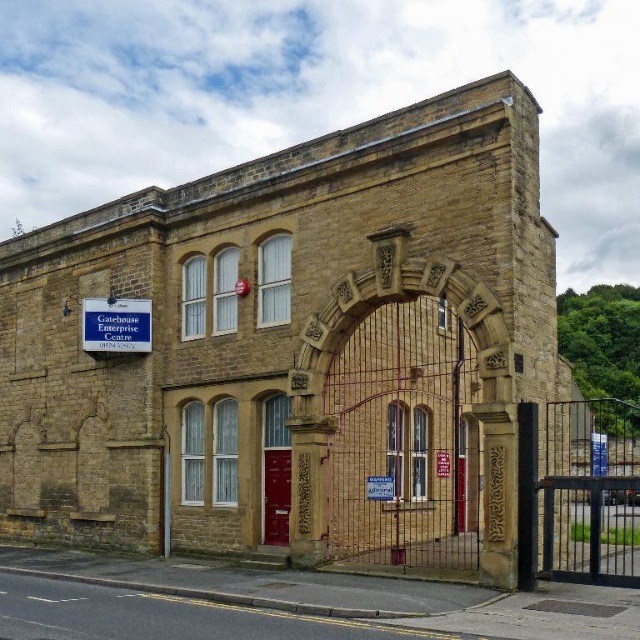
Looking at this image, you are a delivery person trying to read the signs on the building. The blue plastic sign at upper left and the red plastic sign at center both have addresses. Which sign is wider so you can read it better?

The blue plastic sign at upper left might be wider than red plastic sign at center, so it could be easier to read.

You are a delivery person arriving at the Gatehouse Enterprise Centre. You see a blue plastic sign at upper left and a red plastic sign at center. Which sign is bigger?

The blue plastic sign at upper left is larger than the red plastic sign at center.